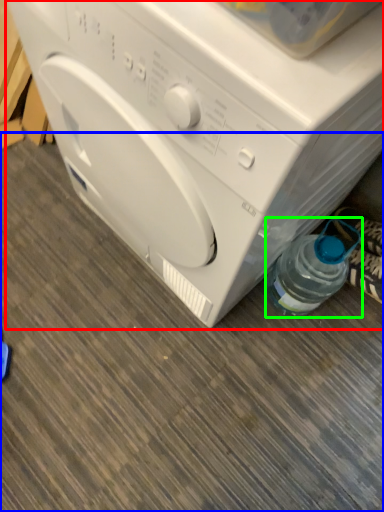
Question: Based on their relative distances, which object is farther from washing machine (highlighted by a red box)? Choose from surface (highlighted by a blue box) and bottle (highlighted by a green box).

Choices:
 (A) surface
 (B) bottle

Answer: (A)